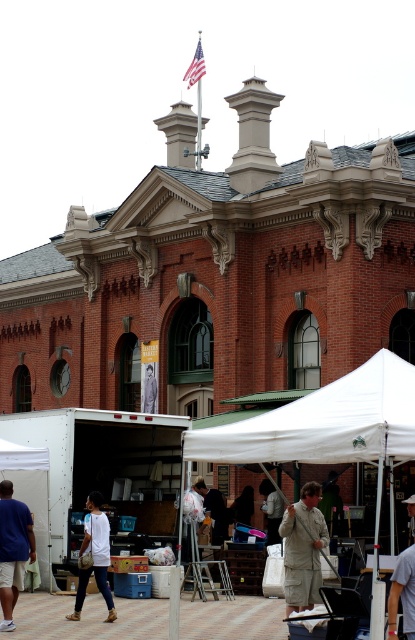
You are standing in front of the historic brick building at the outdoor market. You notice two points marked in the scene. Which point is closer to you, point 1 at coordinates (90, 413) or point 2 at coordinates (261, 456)?

A: Point 1 at coordinates (90, 413) is closer to you because it is further to the camera than point 2 at coordinates (261, 456).

You are a customer at the outdoor market and want to place a large box between the white fabric tent at center and the dark gray fabric bag at center. Which side of the box should you place closer to the wider object to ensure enough space?

The white fabric tent at center is wider than the dark gray fabric bag at center. To ensure enough space, place the box closer to the white fabric tent at center.